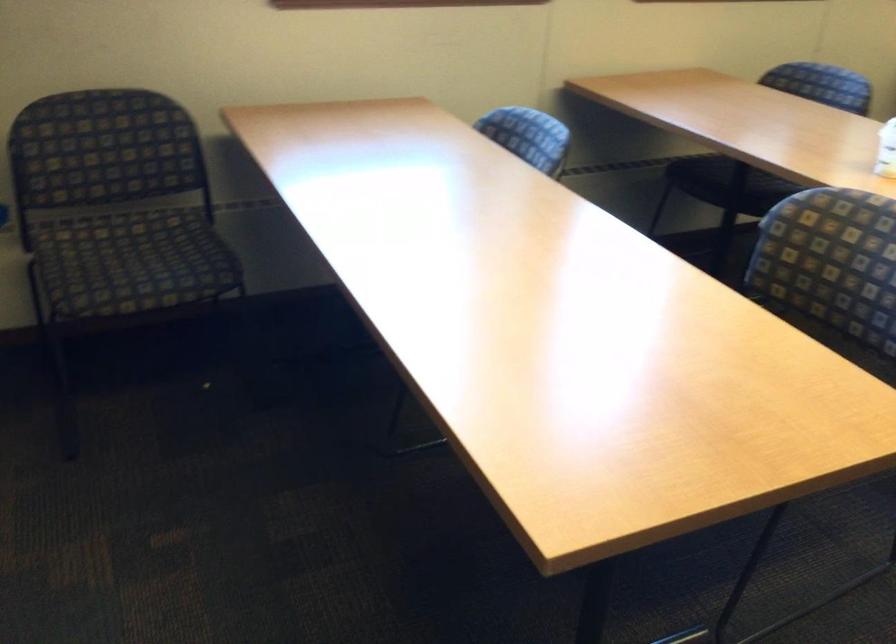
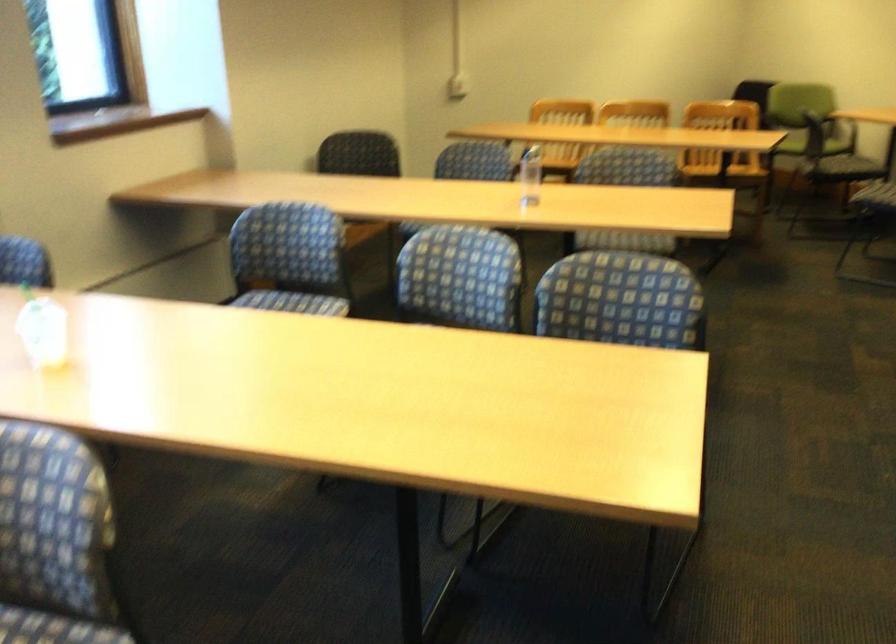
Question: Based on the continuous images, in which direction is the camera rotating? Reply with the corresponding letter.

Choices:
 (A) Left
 (B) Right
 (C) Up
 (D) Down

Answer: (B)